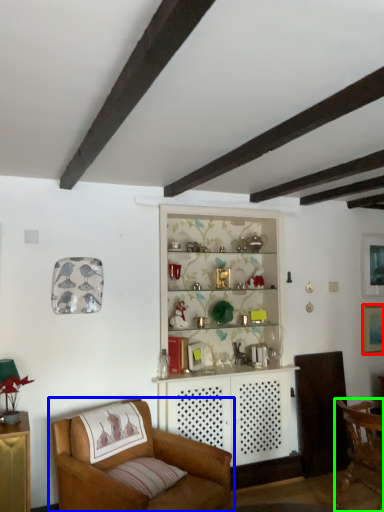
Question: Estimate the real-world distances between objects in this image. Which object is farther from picture frame (highlighted by a red box), chair (highlighted by a blue box) or chair (highlighted by a green box)?

Choices:
 (A) chair
 (B) chair

Answer: (A)